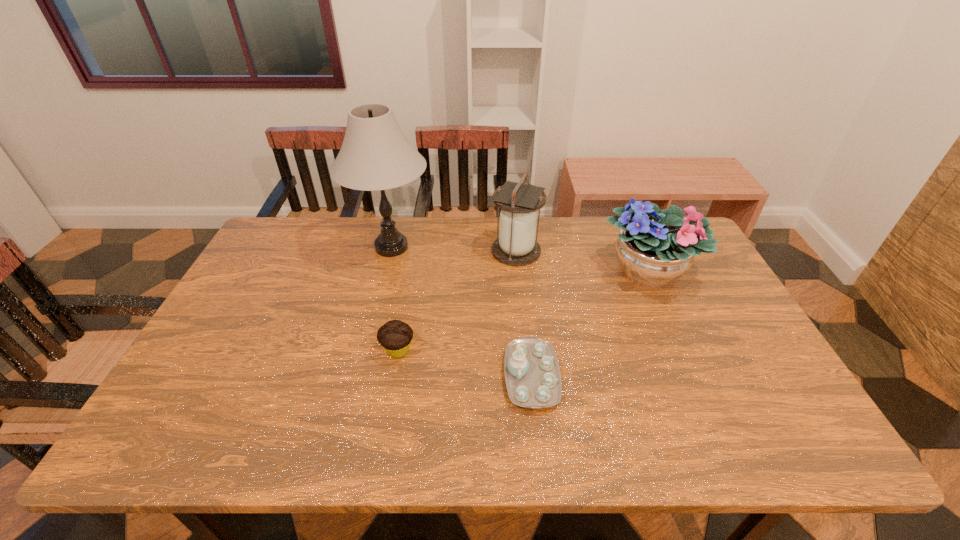
Locate an element on the screen. This screenshot has width=960, height=540. lamp is located at coordinates (375, 155).

Identify the location of lantern. Image resolution: width=960 pixels, height=540 pixels. (519, 202).

At what (x,y) coordinates should I click in order to perform the action: click on the rightmost object. Please return your answer as a coordinate pair (x, y). Looking at the image, I should click on (655, 247).

At what (x,y) coordinates should I click in order to perform the action: click on chinaware. Please return your answer as a coordinate pair (x, y). Looking at the image, I should click on (532, 374).

Identify the location of muffin. (395, 336).

What are the coordinates of `free point located on the right of the lamp` in the screenshot? It's located at (492, 247).

The height and width of the screenshot is (540, 960). I want to click on vacant space situated 0.190m on the front of the lantern, so click(x=521, y=309).

Find the location of `free region located on the back of the rightmost object`. free region located on the back of the rightmost object is located at coordinates (627, 221).

Where is `vacant region located on the back of the chinaware`? vacant region located on the back of the chinaware is located at coordinates (521, 279).

Find the location of a particular element. vacant space located 0.360m on the back of the muffin is located at coordinates (415, 255).